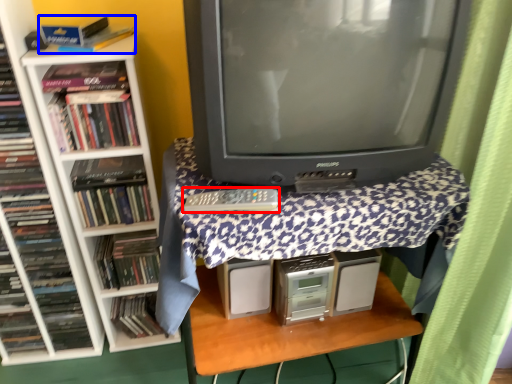
Question: Which object appears farthest to the camera in this image, remote (highlighted by a red box) or book (highlighted by a blue box)?

Choices:
 (A) remote
 (B) book

Answer: (B)